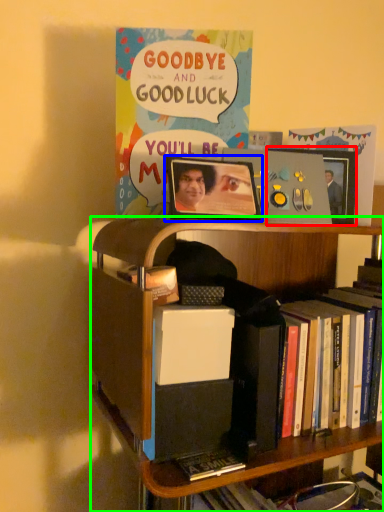
Question: Which object is positioned farthest from picture frame (highlighted by a red box)? Select from picture frame (highlighted by a blue box) and bookcase (highlighted by a green box).

Choices:
 (A) picture frame
 (B) bookcase

Answer: (B)